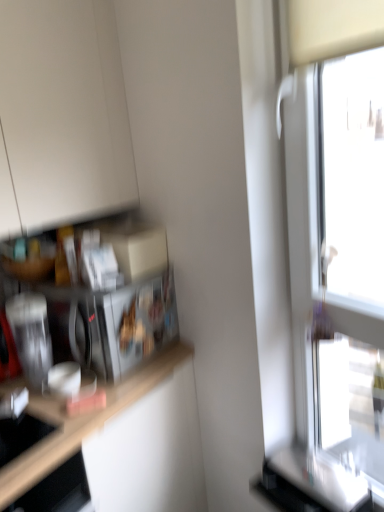
Question: From a real-world perspective, does metallic silver microwave at left stand above transparent glass window at right?

Choices:
 (A) no
 (B) yes

Answer: (A)

Question: Does metallic silver microwave at left have a lesser height compared to transparent glass window at right?

Choices:
 (A) no
 (B) yes

Answer: (B)

Question: From the image's perspective, would you say metallic silver microwave at left is shown under transparent glass window at right?

Choices:
 (A) yes
 (B) no

Answer: (A)

Question: Does metallic silver microwave at left have a greater width compared to transparent glass window at right?

Choices:
 (A) yes
 (B) no

Answer: (A)

Question: Is metallic silver microwave at left far from transparent glass window at right?

Choices:
 (A) no
 (B) yes

Answer: (A)

Question: Is brushed metal toaster at left in front of or behind metallic silver microwave at left in the image?

Choices:
 (A) behind
 (B) front

Answer: (B)

Question: From a real-world perspective, is brushed metal toaster at left physically located above or below metallic silver microwave at left?

Choices:
 (A) below
 (B) above

Answer: (A)

Question: In terms of width, does brushed metal toaster at left look wider or thinner when compared to metallic silver microwave at left?

Choices:
 (A) thin
 (B) wide

Answer: (A)

Question: In terms of height, does brushed metal toaster at left look taller or shorter compared to metallic silver microwave at left?

Choices:
 (A) tall
 (B) short

Answer: (B)

Question: Considering the positions of point (67, 244) and point (302, 283), is point (67, 244) closer or farther from the camera than point (302, 283)?

Choices:
 (A) closer
 (B) farther

Answer: (B)

Question: Based on their positions, is metallic silver microwave at left located to the left or right of transparent glass window at right?

Choices:
 (A) left
 (B) right

Answer: (A)

Question: Would you say metallic silver microwave at left is inside or outside transparent glass window at right?

Choices:
 (A) inside
 (B) outside

Answer: (B)

Question: From a real-world perspective, is metallic silver microwave at left above or below transparent glass window at right?

Choices:
 (A) above
 (B) below

Answer: (B)

Question: From the image's perspective, is brushed metal toaster at left positioned above or below transparent glass window at right?

Choices:
 (A) below
 (B) above

Answer: (A)

Question: From their relative heights in the image, would you say brushed metal toaster at left is taller or shorter than transparent glass window at right?

Choices:
 (A) short
 (B) tall

Answer: (A)